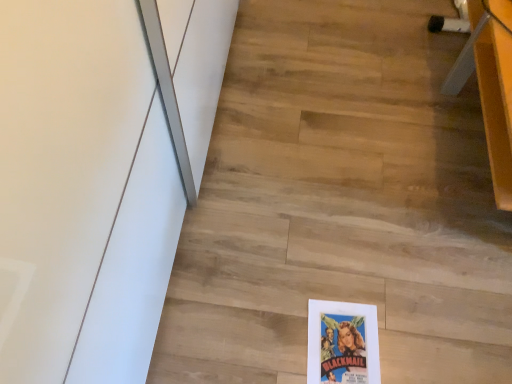
Question: Do you think wooden desk at upper right is within wooden floor at center, or outside of it?

Choices:
 (A) outside
 (B) inside

Answer: (A)

Question: From a real-world perspective, relative to wooden floor at center, is wooden desk at upper right vertically above or below?

Choices:
 (A) above
 (B) below

Answer: (A)

Question: Considering the positions of wooden desk at upper right and wooden floor at center in the image, is wooden desk at upper right bigger or smaller than wooden floor at center?

Choices:
 (A) small
 (B) big

Answer: (B)

Question: From the image's perspective, is wooden floor at center above or below wooden desk at upper right?

Choices:
 (A) above
 (B) below

Answer: (B)

Question: Would you say wooden floor at center is inside or outside wooden desk at upper right?

Choices:
 (A) inside
 (B) outside

Answer: (B)

Question: From a real-world perspective, is wooden floor at center above or below wooden desk at upper right?

Choices:
 (A) above
 (B) below

Answer: (B)

Question: Is point (394, 51) closer or farther from the camera than point (480, 94)?

Choices:
 (A) closer
 (B) farther

Answer: (B)